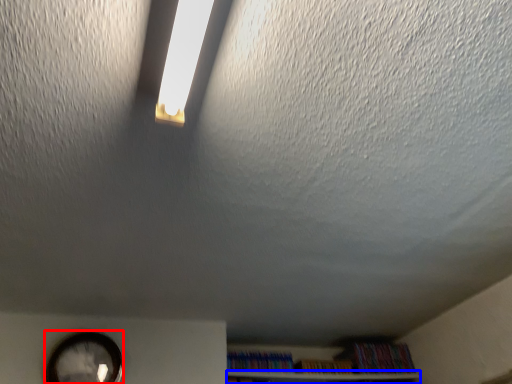
Question: Among these objects, which one is farthest to the camera, clock (highlighted by a red box) or shelf (highlighted by a blue box)?

Choices:
 (A) clock
 (B) shelf

Answer: (B)